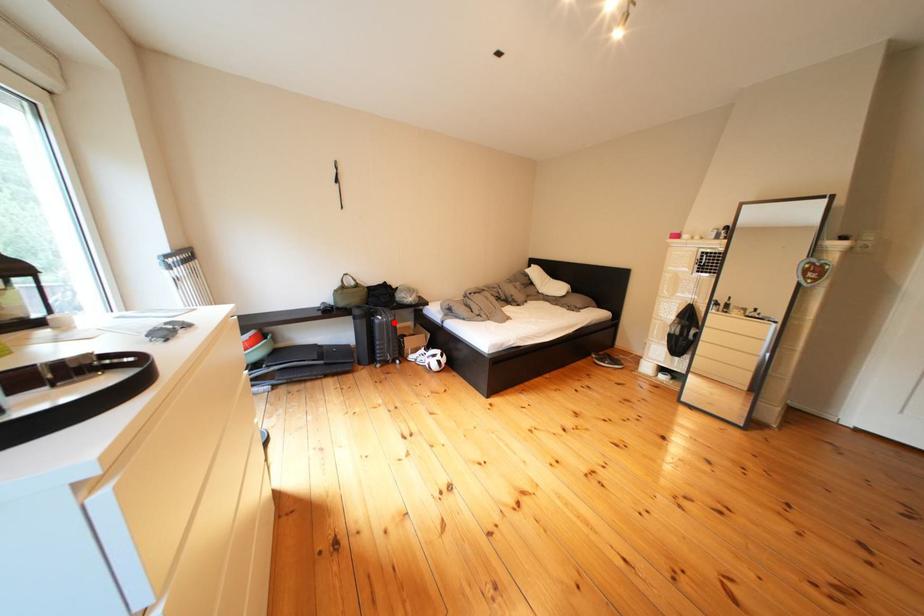
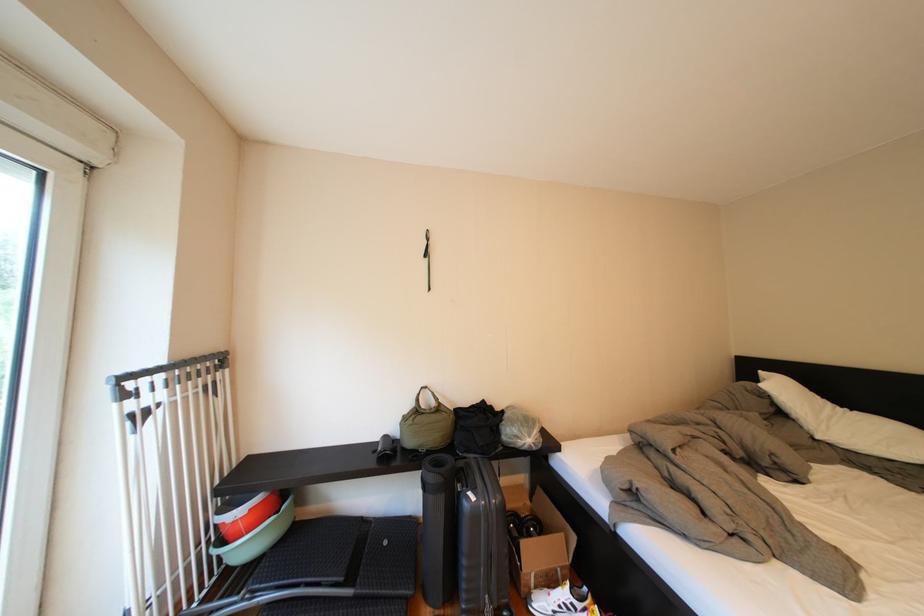
Question: I am providing you with two images of the same scene from different viewpoints. A red point is marked on the first image. At the location where the point appears in image 1, is it still visible in image 2?

Choices:
 (A) Yes
 (B) No

Answer: (A)